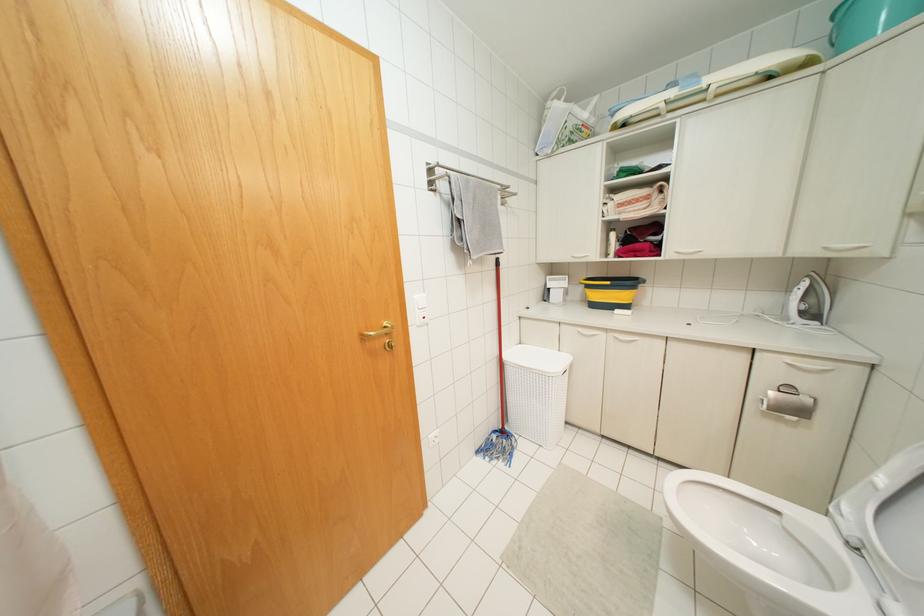
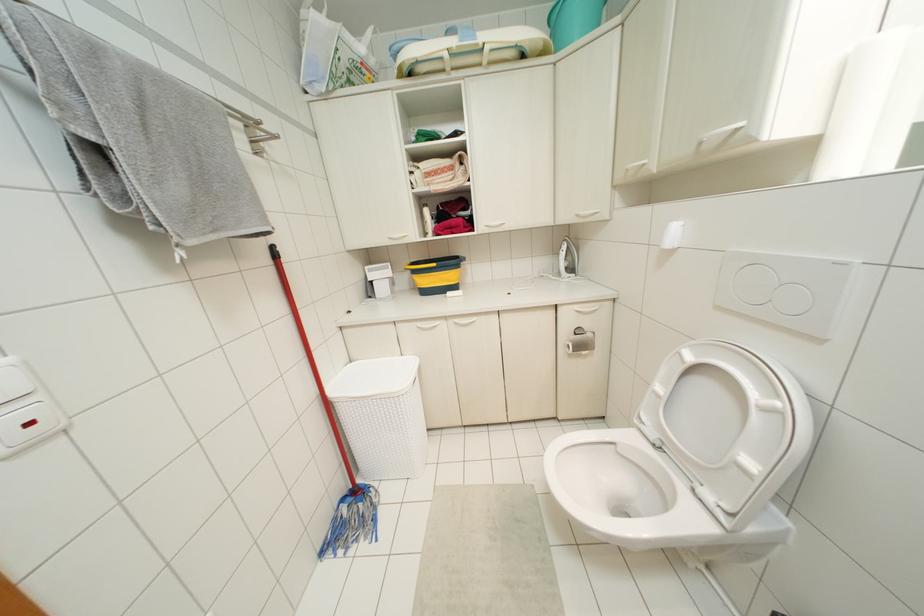
Find the pixel in the second image that matches (882,480) in the first image.

(659, 387)